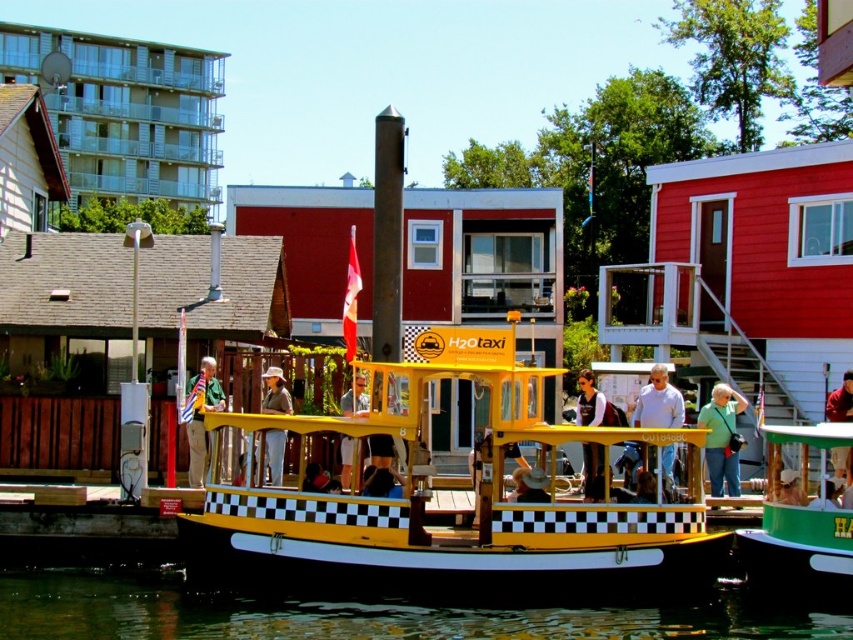
You are planning to place a denim jacket at center onto the yellow matte taxi boat at center. Based on their sizes, will the jacket fit comfortably on the boat?

The yellow matte taxi boat at center is wider than the denim jacket at center, so the jacket will fit comfortably on the boat.

You are a passenger waiting to board a boat. You see the yellow matte taxi boat at center and the green matte boat at center. Which boat is closer to you?

The yellow matte taxi boat at center is closer to you because the green matte boat at center is behind it.

You are a photographer planning to capture the yellow matte taxi boat at center and the denim jacket at center in a single frame. Given their sizes, which object should you focus on to ensure both are clearly visible in the photo?

The yellow matte taxi boat at center is larger in size than the denim jacket at center, so focusing on the boat will help ensure both objects are clearly visible in the photo.